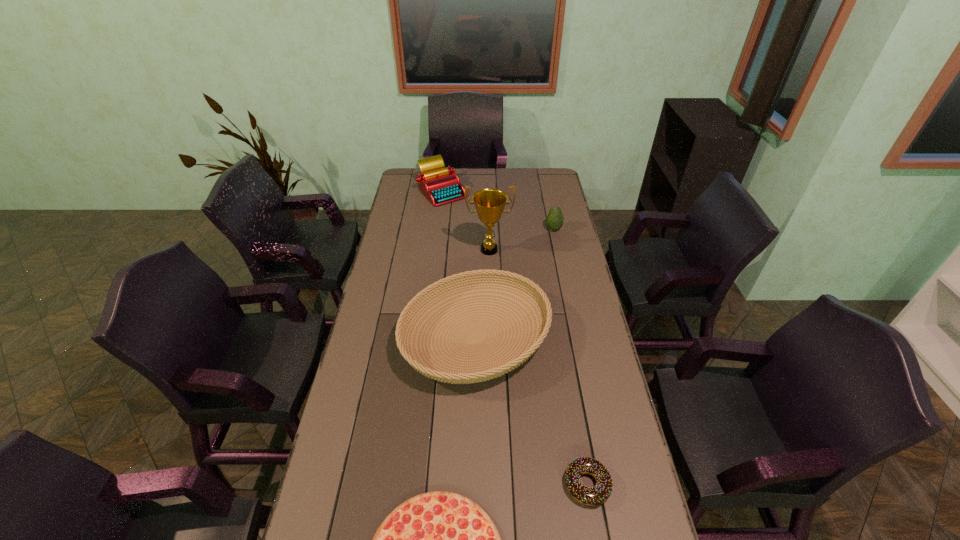
Where is `free space located on the back of the fifth tallest object`? The width and height of the screenshot is (960, 540). free space located on the back of the fifth tallest object is located at coordinates (564, 355).

At what (x,y) coordinates should I click in order to perform the action: click on object that is positioned at the far edge. Please return your answer as a coordinate pair (x, y). This screenshot has width=960, height=540. Looking at the image, I should click on (440, 185).

This screenshot has height=540, width=960. I want to click on typewriter at the left edge, so click(440, 185).

The width and height of the screenshot is (960, 540). Find the location of `basket present at the left edge`. basket present at the left edge is located at coordinates (438, 370).

The width and height of the screenshot is (960, 540). I want to click on avocado that is at the right edge, so click(x=554, y=221).

Locate an element on the screen. doughnut located in the right edge section of the desktop is located at coordinates (594, 496).

Where is `object that is at the far left corner`? object that is at the far left corner is located at coordinates (440, 185).

The image size is (960, 540). In the image, there is a desktop. What are the coordinates of `vacant space at the far edge` in the screenshot? It's located at (495, 171).

This screenshot has height=540, width=960. In order to click on vacant area at the left edge of the desktop in this screenshot , I will do `click(400, 357)`.

The width and height of the screenshot is (960, 540). I want to click on free space at the right edge of the desktop, so click(x=588, y=363).